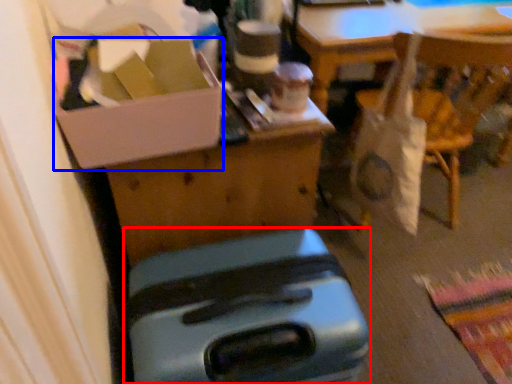
Question: Which object is closer to the camera taking this photo, luggage (highlighted by a red box) or box (highlighted by a blue box)?

Choices:
 (A) luggage
 (B) box

Answer: (A)